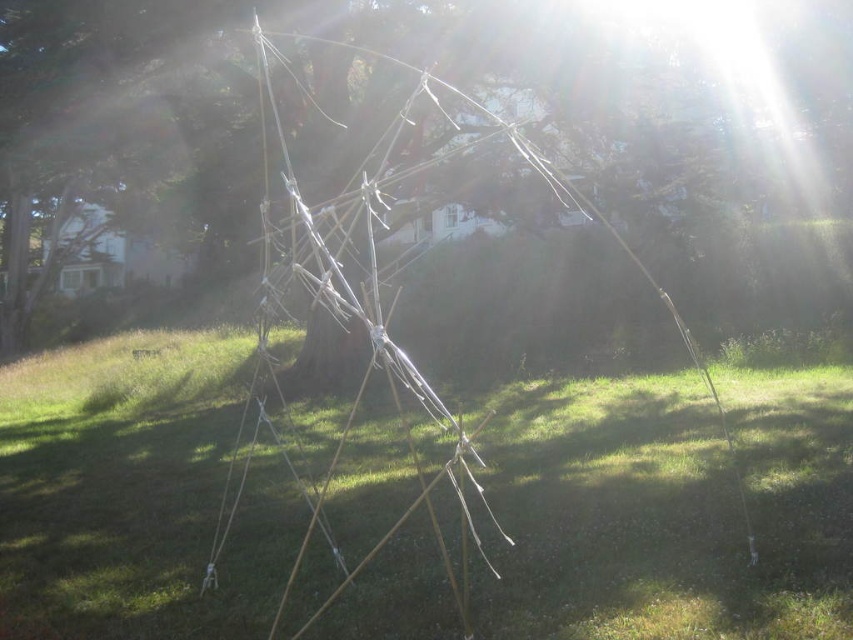
Question: Observing the image, what is the correct spatial positioning of green grass at center in reference to white stringy structure at center?

Choices:
 (A) below
 (B) above

Answer: (A)

Question: Can you confirm if green grass at center is positioned above white stringy structure at center?

Choices:
 (A) no
 (B) yes

Answer: (A)

Question: Is green grass at center further to the viewer compared to white stringy structure at center?

Choices:
 (A) yes
 (B) no

Answer: (A)

Question: Among these objects, which one is farthest from the camera?

Choices:
 (A) white stringy structure at center
 (B) green grass at center

Answer: (B)